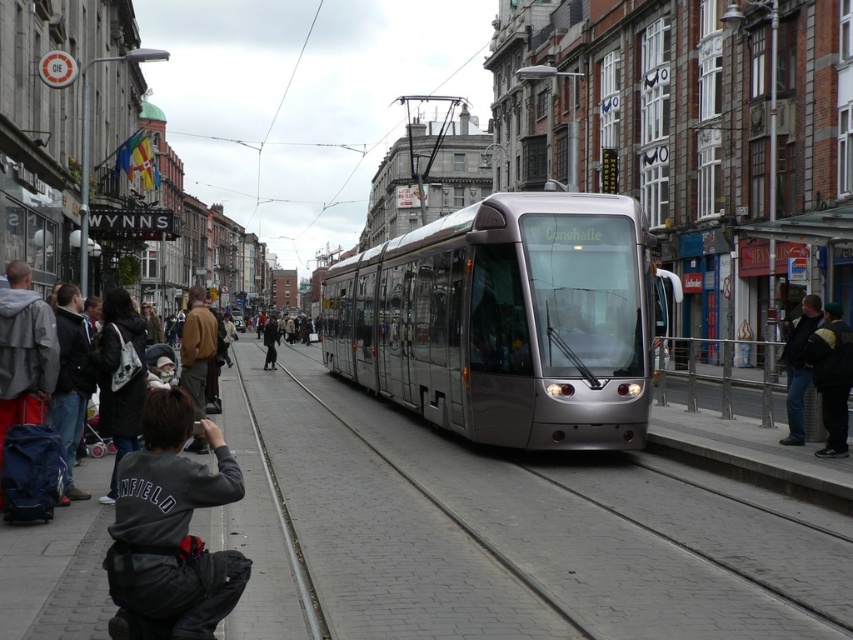
Question: Can you confirm if matte gray jacket at left is smaller than black leather jacket at lower right?

Choices:
 (A) yes
 (B) no

Answer: (A)

Question: Can you confirm if dark gray jacket at left is positioned above black leather jacket at lower right?

Choices:
 (A) yes
 (B) no

Answer: (A)

Question: Among these objects, which one is nearest to the camera?

Choices:
 (A) black leather jacket at lower right
 (B) metallic silver tram at center
 (C) metal/smooth train track at center

Answer: (C)

Question: Estimate the real-world distances between objects in this image. Which object is farther from the dark gray sweatshirt at lower left?

Choices:
 (A) dark gray jacket at center
 (B) metallic silver tram at center
 (C) black leather jacket at lower right

Answer: (A)

Question: Which object is the closest to the dark gray sweatshirt at lower left?

Choices:
 (A) dark gray jacket at left
 (B) dark gray jacket at center
 (C) black leather jacket at lower right

Answer: (A)

Question: Does matte gray jacket at left come in front of black leather jacket at lower right?

Choices:
 (A) no
 (B) yes

Answer: (B)